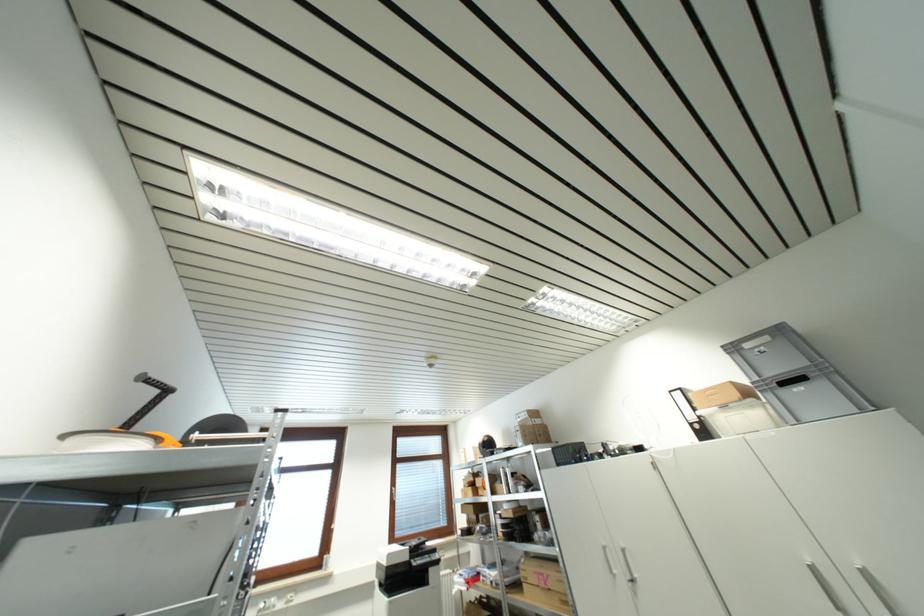
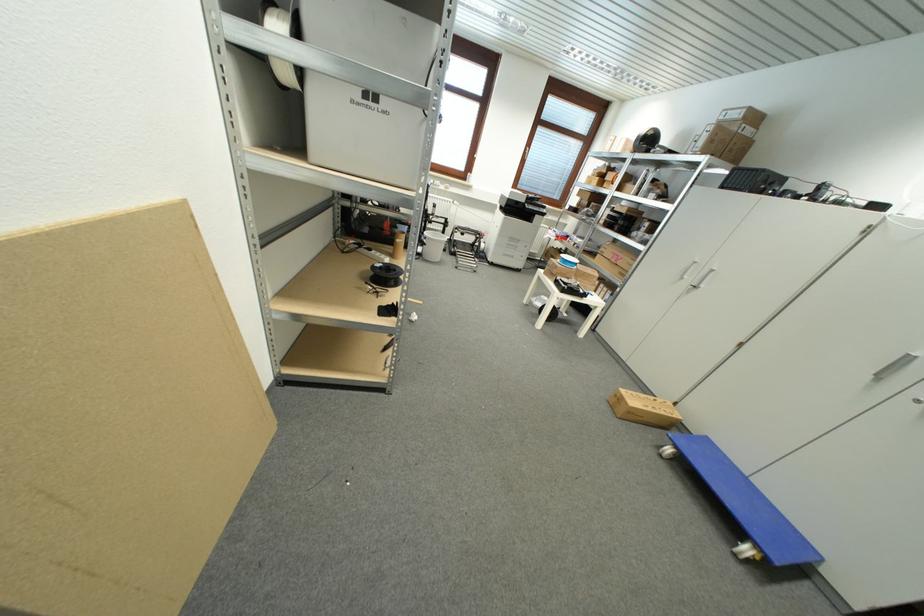
Where in the second image is the point corresponding to pixel 550 585 from the first image?

(621, 262)